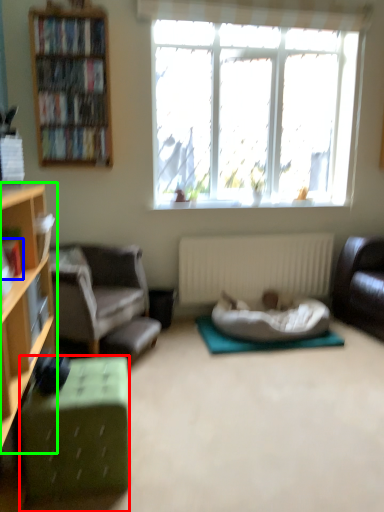
Question: Considering the real-world distances, which object is closest to desk (highlighted by a red box)? book (highlighted by a blue box) or cabinetry (highlighted by a green box).

Choices:
 (A) book
 (B) cabinetry

Answer: (B)